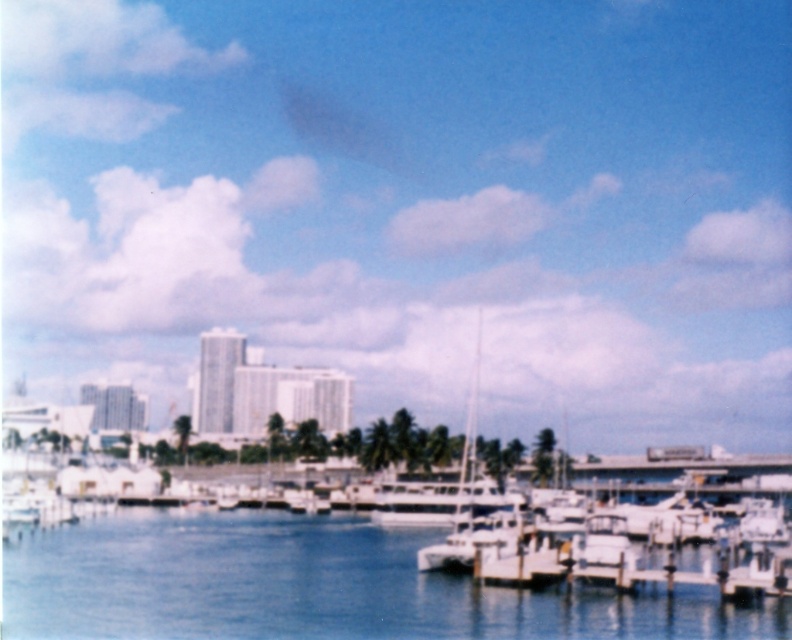
Question: Is clear blue water at center bigger than white glossy sailboat at center?

Choices:
 (A) yes
 (B) no

Answer: (B)

Question: Which point appears farthest from the camera in this image?

Choices:
 (A) (499, 547)
 (B) (181, 556)

Answer: (B)

Question: Is clear blue water at center to the left of white glossy sailboat at center from the viewer's perspective?

Choices:
 (A) yes
 (B) no

Answer: (A)

Question: Is clear blue water at center to the right of white glossy sailboat at center from the viewer's perspective?

Choices:
 (A) no
 (B) yes

Answer: (A)

Question: Which of the following is the closest to the observer?

Choices:
 (A) white glossy sailboat at center
 (B) clear blue water at center

Answer: (B)